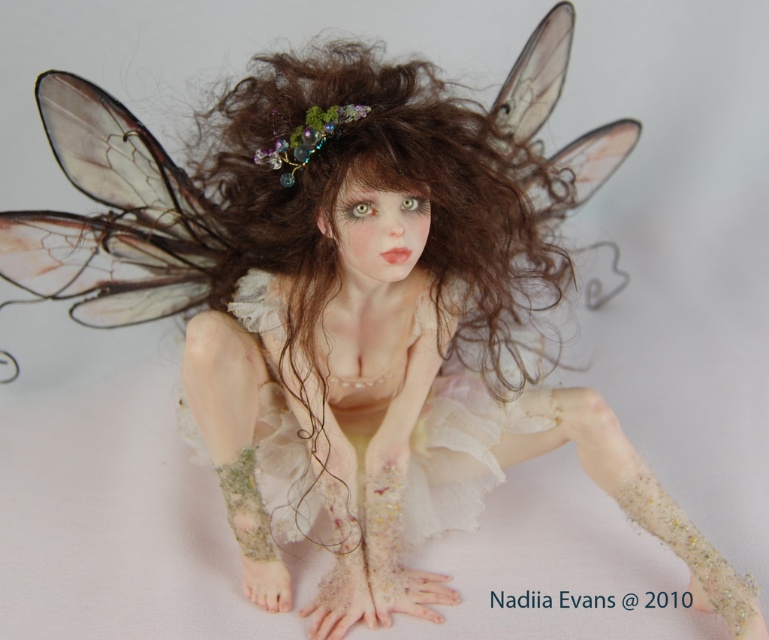
Between point (247, 308) and point (305, 125), which one is positioned behind?

Point (247, 308)

Is translucent lace dress at center above translucent gemstone hair ornament at center?

No.

Locate an element on the screen. The height and width of the screenshot is (640, 769). translucent lace dress at center is located at coordinates (461, 451).